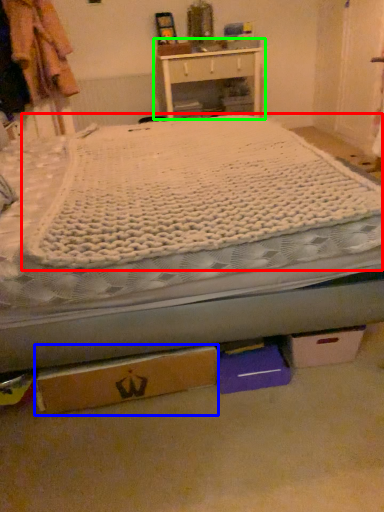
Question: Which object is the farthest from mattress (highlighted by a red box)? Choose among these: cardboard box (highlighted by a blue box) or nightstand (highlighted by a green box).

Choices:
 (A) cardboard box
 (B) nightstand

Answer: (B)